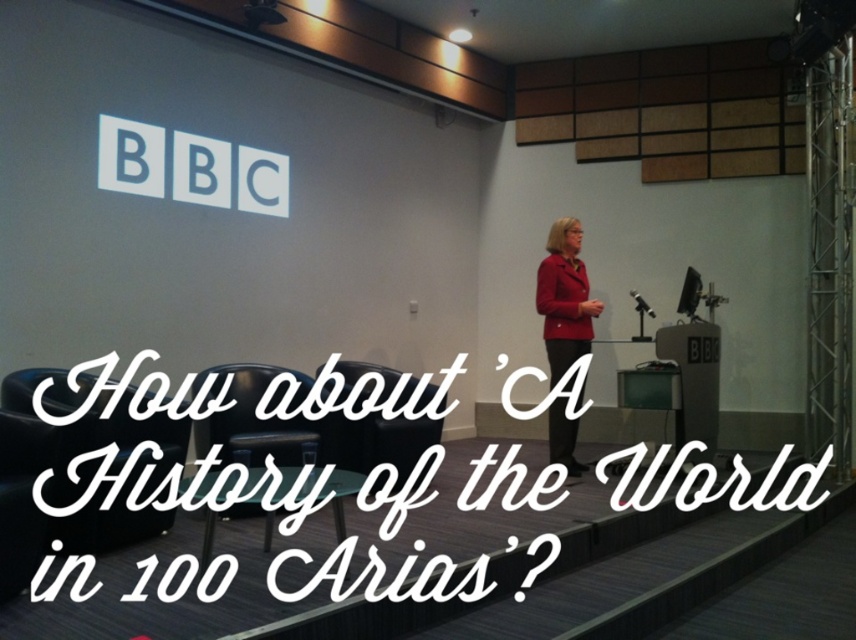
Can you confirm if red smooth jacket at center is shorter than matte black screen at upper center?

Incorrect, red smooth jacket at center's height does not fall short of matte black screen at upper center's.

Between red smooth jacket at center and matte black screen at upper center, which one has less height?

Standing shorter between the two is matte black screen at upper center.

Image resolution: width=856 pixels, height=640 pixels. Identify the location of red smooth jacket at center. (563, 298).

Is black leather chair at center to the right of matte black screen at upper center from the viewer's perspective?

In fact, black leather chair at center is to the left of matte black screen at upper center.

Based on the photo, between black leather chair at center and matte black screen at upper center, which one appears on the right side from the viewer's perspective?

From the viewer's perspective, matte black screen at upper center appears more on the right side.

Which is behind, point (345, 433) or point (687, 308)?

Positioned behind is point (687, 308).

Where is `black leather chair at center`? The image size is (856, 640). black leather chair at center is located at coordinates (389, 442).

Does red smooth jacket at center have a larger size compared to black leather chair at center?

No, red smooth jacket at center is not bigger than black leather chair at center.

I want to click on red smooth jacket at center, so click(563, 298).